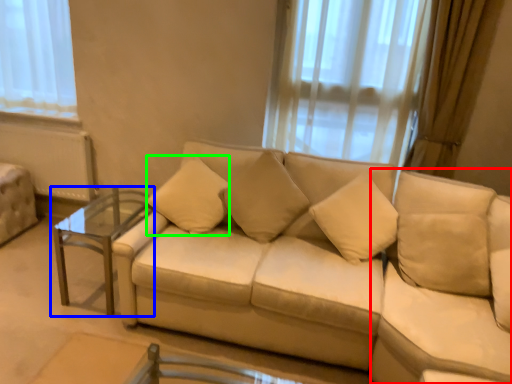
Question: Which object is the closest to the swivel chair (highlighted by a red box)? Choose among these: table (highlighted by a blue box) or pillow (highlighted by a green box).

Choices:
 (A) table
 (B) pillow

Answer: (B)